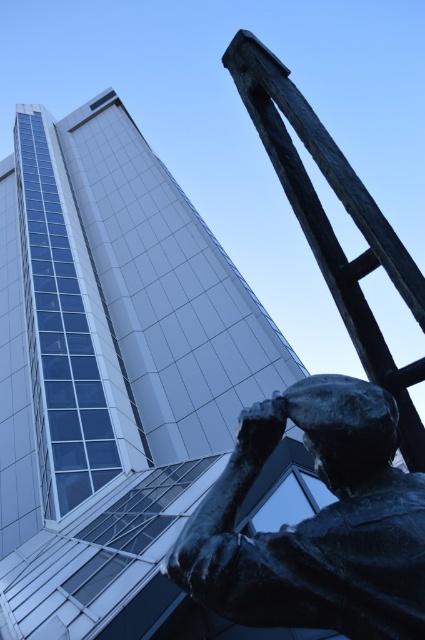
You are an art student analyzing the urban scene. You notice the bronze statue at lower right and the bronze textured ladder at upper right. Based on their positions, which object is closer to the viewer?

The bronze statue at lower right is closer to the viewer because it is located below the bronze textured ladder at upper right, indicating it is positioned lower in the visual plane.

You are standing in front of the modern architectural structure and want to take a photo of the bronze statue at lower right. If your camera has a minimum focus distance of 4 feet, will you be able to take a clear photo without moving closer?

The bronze statue at lower right is 4.26 feet away from the viewer. Since the minimum focus distance is 4 feet, the camera can focus on the statue as the distance is within the required range, so yes, you can take a clear photo without moving closer.

You are an architect designing a new urban plaza and need to place a bench between the bronze statue at lower right and the bronze textured ladder at upper right. Given their sizes, which object should the bench be closer to to ensure it doesn

The bench should be placed closer to the bronze statue at lower right because it is narrower than the bronze textured ladder at upper right, allowing for better spacing between the two objects.